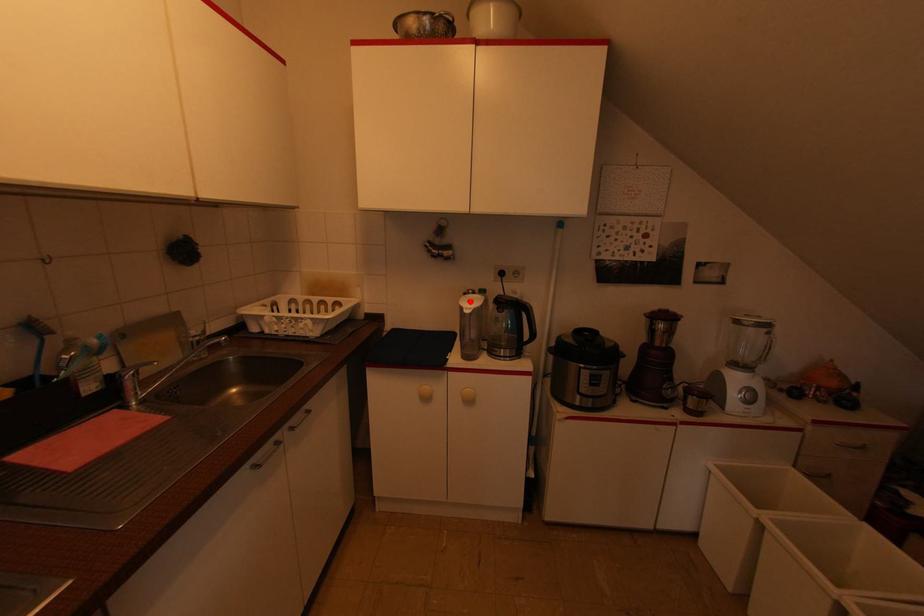
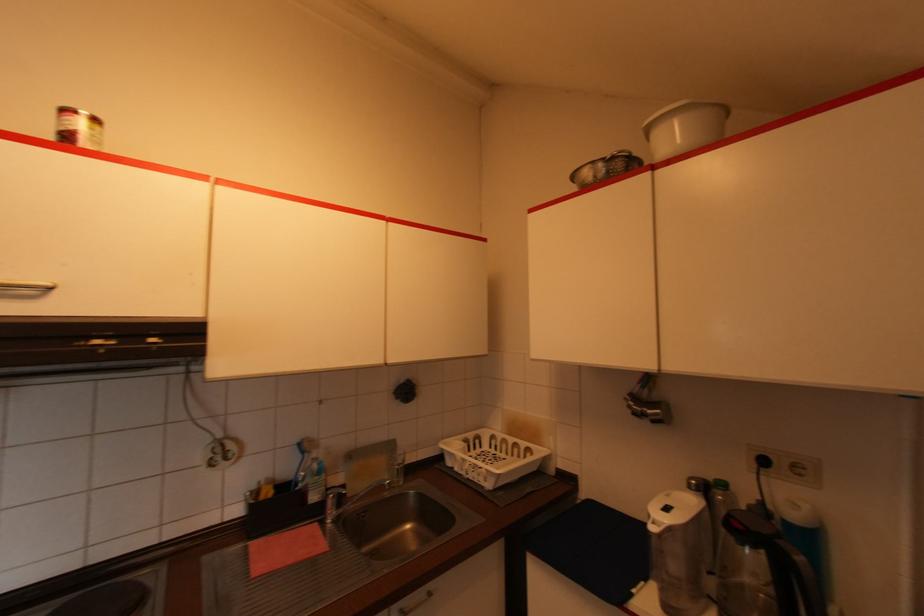
Find the pixel in the second image that matches the highlighted location in the first image.

(666, 511)